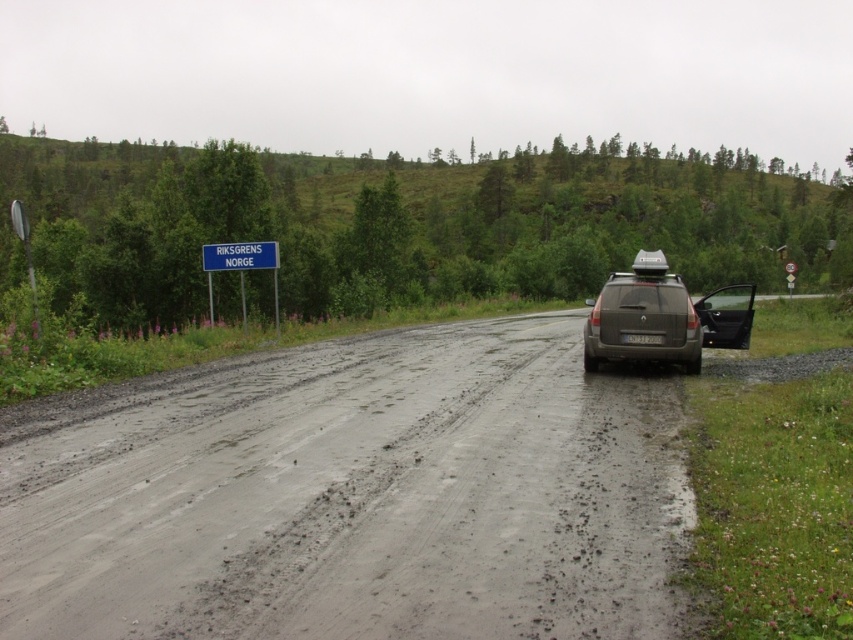
Does blue metallic sign at left have a greater width compared to white plastic license plate at center?

Indeed, blue metallic sign at left has a greater width compared to white plastic license plate at center.

In the scene shown: Which is more to the right, blue metallic sign at left or white plastic license plate at center?

From the viewer's perspective, white plastic license plate at center appears more on the right side.

Image resolution: width=853 pixels, height=640 pixels. I want to click on blue metallic sign at left, so click(242, 268).

Is satin silver suv at right bigger than white plastic license plate at center?

Yes.

Can you confirm if satin silver suv at right is positioned above white plastic license plate at center?

Yes, satin silver suv at right is above white plastic license plate at center.

What do you see at coordinates (663, 316) in the screenshot? This screenshot has width=853, height=640. I see `satin silver suv at right` at bounding box center [663, 316].

Identify the location of satin silver suv at right. (663, 316).

Is blue plastic sign at upper center wider than white plastic license plate at center?

Yes.

Is point (213, 252) farther from viewer compared to point (653, 340)?

Yes, it is behind point (653, 340).

Which is in front, point (222, 268) or point (656, 336)?

Point (656, 336) is in front.

This screenshot has width=853, height=640. I want to click on blue plastic sign at upper center, so click(241, 256).